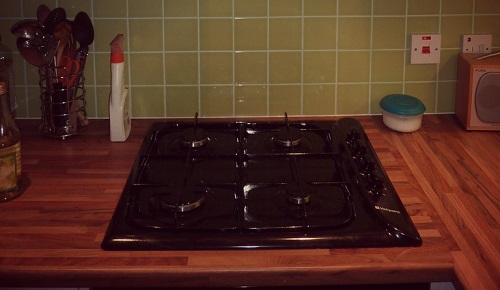
Identify the location of stove. (x=250, y=173).